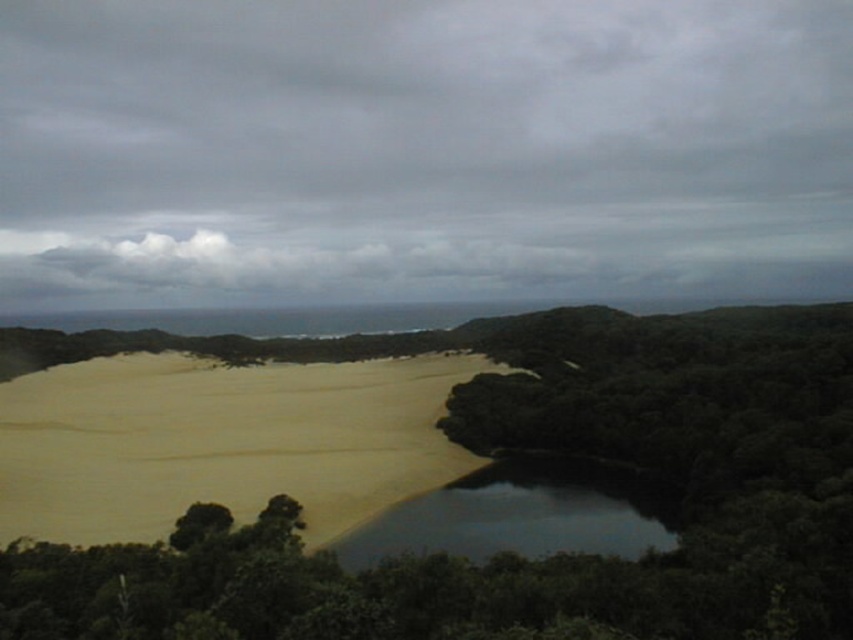
Question: Can you confirm if gray cloudy sky at upper center is positioned above green leafy tree at lower left?

Choices:
 (A) no
 (B) yes

Answer: (B)

Question: Can you confirm if dark reflective water at center is bigger than green leafy tree at lower left?

Choices:
 (A) yes
 (B) no

Answer: (A)

Question: Is gray cloudy sky at upper center to the left of dark reflective water at center from the viewer's perspective?

Choices:
 (A) no
 (B) yes

Answer: (B)

Question: Which point is farther to the camera?

Choices:
 (A) dark reflective water at center
 (B) gray cloudy sky at upper center

Answer: (B)

Question: Which of the following is the farthest from the observer?

Choices:
 (A) (177, 548)
 (B) (596, 538)
 (C) (186, 13)

Answer: (C)

Question: Which of the following is the farthest from the observer?

Choices:
 (A) (566, 544)
 (B) (225, 522)
 (C) (346, 380)

Answer: (C)